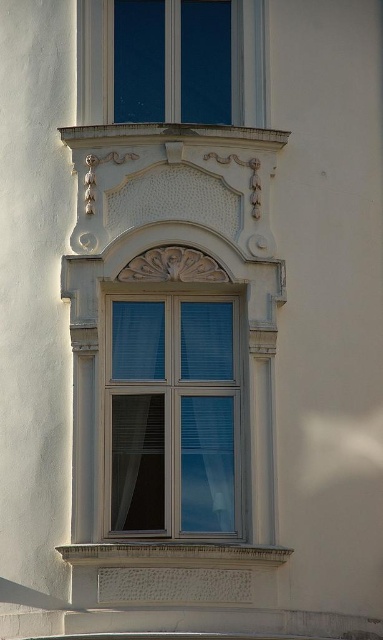
You are standing in front of the building and notice two points marked on the facade. The first point is at coordinates point (163, 326) and the second is at point (137, 32). From your perspective, which point appears closer to you?

Point (163, 326) is in front of point (137, 32), so it appears closer to you.